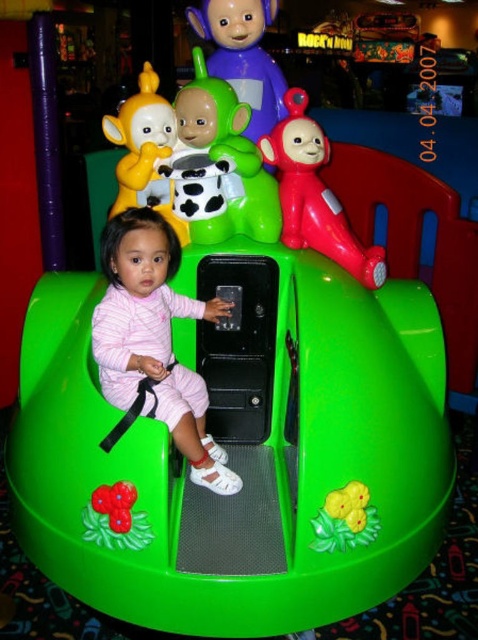
Based on the photo, between rubberized red teletubbie at center and purple matte teletubby at upper center, which one has less height?

Standing shorter between the two is purple matte teletubby at upper center.

Which is behind, point (295, 93) or point (273, 70)?

The point (273, 70) is behind.

Between point (285, 211) and point (271, 80), which one is positioned in front?

Point (285, 211) is more forward.

Where is `rubberized red teletubbie at center`? This screenshot has width=478, height=640. rubberized red teletubbie at center is located at coordinates pyautogui.click(x=315, y=195).

Does pink cotton onesie at center have a smaller size compared to cow print plastic cup at upper center?

No.

Does pink cotton onesie at center have a greater height compared to cow print plastic cup at upper center?

Yes.

Locate an element on the screen. The image size is (478, 640). pink cotton onesie at center is located at coordinates (154, 339).

Find the location of `pink cotton onesie at center`. pink cotton onesie at center is located at coordinates (154, 339).

Is pink cotton onesie at center further to the viewer compared to rubberized green flower at lower left?

That is True.

Identify the location of pink cotton onesie at center. (154, 339).